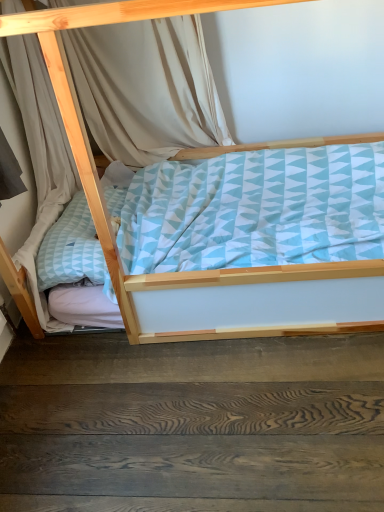
Question: Should I look upward or downward to see dark wood floor at lower center?

Choices:
 (A) down
 (B) up

Answer: (A)

Question: From a real-world perspective, is light blue fabric bed at center located beneath dark wood floor at lower center?

Choices:
 (A) no
 (B) yes

Answer: (A)

Question: Does light blue fabric bed at center appear on the right side of dark wood floor at lower center?

Choices:
 (A) yes
 (B) no

Answer: (A)

Question: Considering the relative sizes of light blue fabric bed at center and dark wood floor at lower center in the image provided, is light blue fabric bed at center bigger than dark wood floor at lower center?

Choices:
 (A) yes
 (B) no

Answer: (A)

Question: Is light blue fabric bed at center facing towards dark wood floor at lower center?

Choices:
 (A) yes
 (B) no

Answer: (A)

Question: Does light blue fabric bed at center have a lesser width compared to dark wood floor at lower center?

Choices:
 (A) no
 (B) yes

Answer: (A)

Question: Considering the relative positions of light blue fabric bed at center and dark wood floor at lower center in the image provided, is light blue fabric bed at center to the left of dark wood floor at lower center from the viewer's perspective?

Choices:
 (A) no
 (B) yes

Answer: (A)

Question: Does beige fabric curtain at upper left have a greater height compared to light blue fabric bed at center?

Choices:
 (A) yes
 (B) no

Answer: (B)

Question: Is beige fabric curtain at upper left positioned before light blue fabric bed at center?

Choices:
 (A) no
 (B) yes

Answer: (A)

Question: Is beige fabric curtain at upper left to the left of light blue fabric bed at center from the viewer's perspective?

Choices:
 (A) no
 (B) yes

Answer: (B)

Question: From the image's perspective, is beige fabric curtain at upper left under light blue fabric bed at center?

Choices:
 (A) no
 (B) yes

Answer: (A)

Question: Is light blue fabric bed at center located within beige fabric curtain at upper left?

Choices:
 (A) yes
 (B) no

Answer: (B)

Question: Is beige fabric curtain at upper left positioned far away from light blue fabric bed at center?

Choices:
 (A) yes
 (B) no

Answer: (B)

Question: From a real-world perspective, is dark wood floor at lower center located beneath light blue fabric bed at center?

Choices:
 (A) no
 (B) yes

Answer: (B)